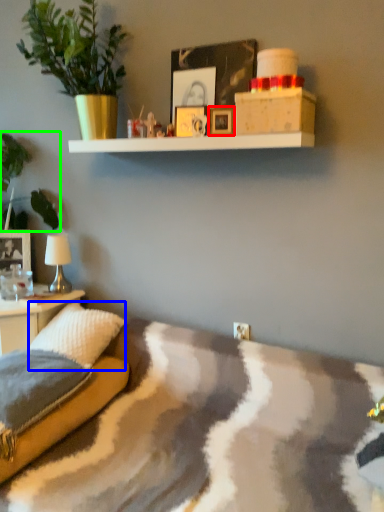
Question: Estimate the real-world distances between objects in this image. Which object is closer to picture frame (highlighted by a red box), pillow (highlighted by a blue box) or plant (highlighted by a green box)?

Choices:
 (A) pillow
 (B) plant

Answer: (A)